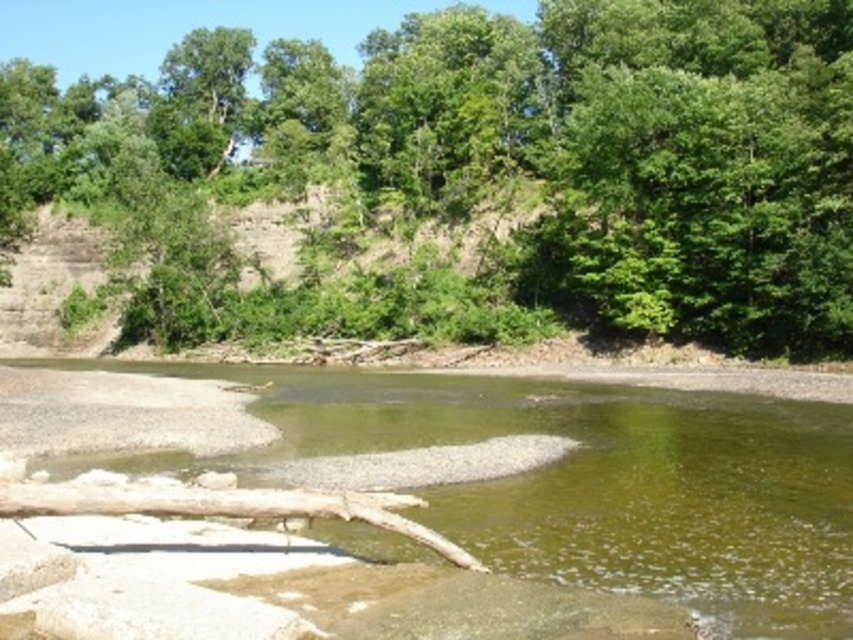
You are standing at the edge of the river and see the green leafy tree at center and the green sedimentary rock at center. Which object is closer to your left side?

The green leafy tree at center is to the left of the green sedimentary rock at center, so it is closer to your left side.

Based on the photo, you are a hiker trying to cross the river using the brown wood log at lower center. The green leafy tree at center is blocking your path. Can you walk around the tree to reach the log?

The green leafy tree at center is larger than the brown wood log at lower center, but since the log is at the lower center and the tree is at the center, you can walk around the tree to reach the log as long as there is enough space between them.

You are an environmental scientist assessing the river ecosystem. You observe the green leafy tree at center and the green sedimentary rock at center. Which object would likely provide more shade to the river, and why?

The green leafy tree at center is bigger than the green sedimentary rock at center, so it would provide more shade to the river because larger trees typically cast broader shadows than rocks.